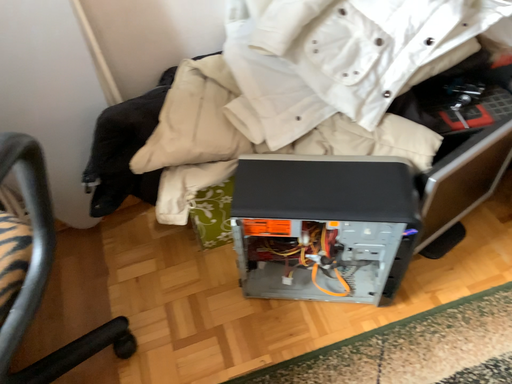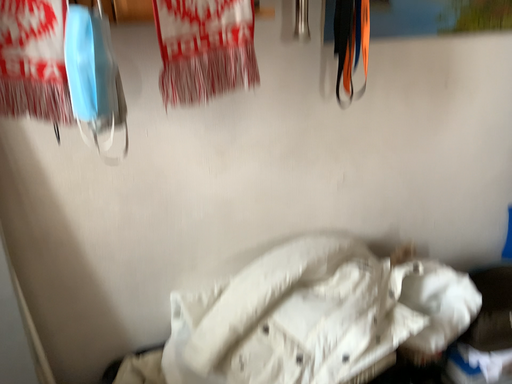
Question: How did the camera likely rotate when shooting the video?

Choices:
 (A) rotated downward
 (B) rotated upward

Answer: (B)